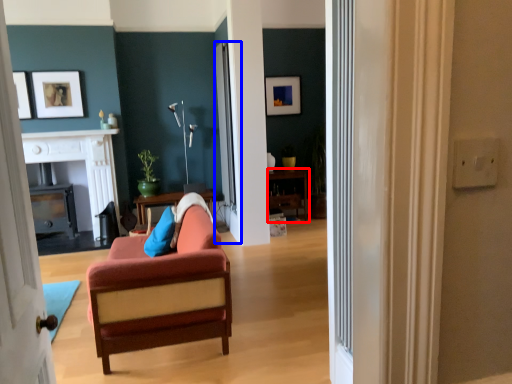
Question: Which of the following is the farthest to the observer, table (highlighted by a red box) or glass door (highlighted by a blue box)?

Choices:
 (A) table
 (B) glass door

Answer: (A)